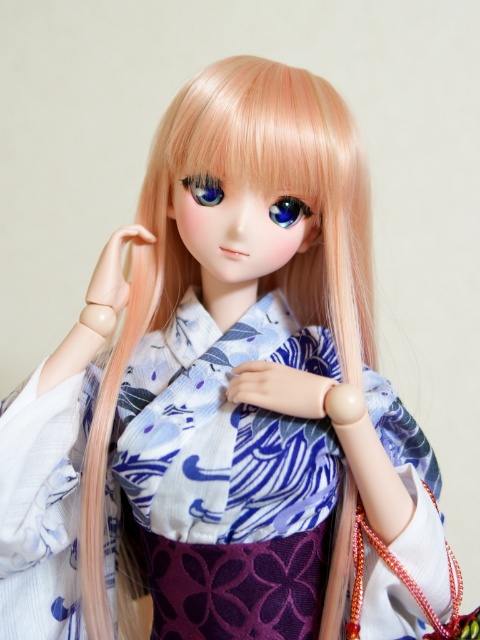
Question: Among these points, which one is farthest from the camera?

Choices:
 (A) (204, 192)
 (B) (282, 200)

Answer: (A)

Question: Is glossy blue eye at center to the left of blue glossy eye at center from the viewer's perspective?

Choices:
 (A) yes
 (B) no

Answer: (B)

Question: Observing the image, what is the correct spatial positioning of glossy blue eye at center in reference to blue glossy eye at center?

Choices:
 (A) below
 (B) above

Answer: (A)

Question: From the image, what is the correct spatial relationship of glossy blue eye at center in relation to blue glossy eye at center?

Choices:
 (A) right
 (B) left

Answer: (A)

Question: Which point appears closest to the camera in this image?

Choices:
 (A) 220,195
 (B) 290,200

Answer: (A)